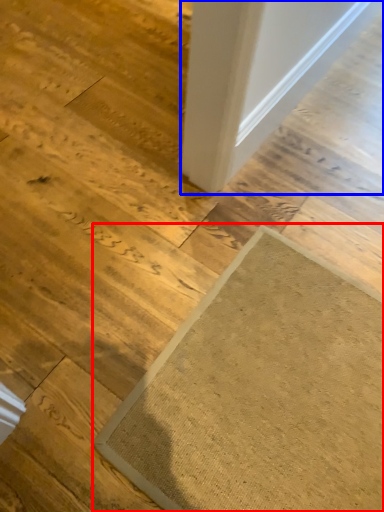
Question: Which of the following is the closest to the observer, mat (highlighted by a red box) or door (highlighted by a blue box)?

Choices:
 (A) mat
 (B) door

Answer: (A)